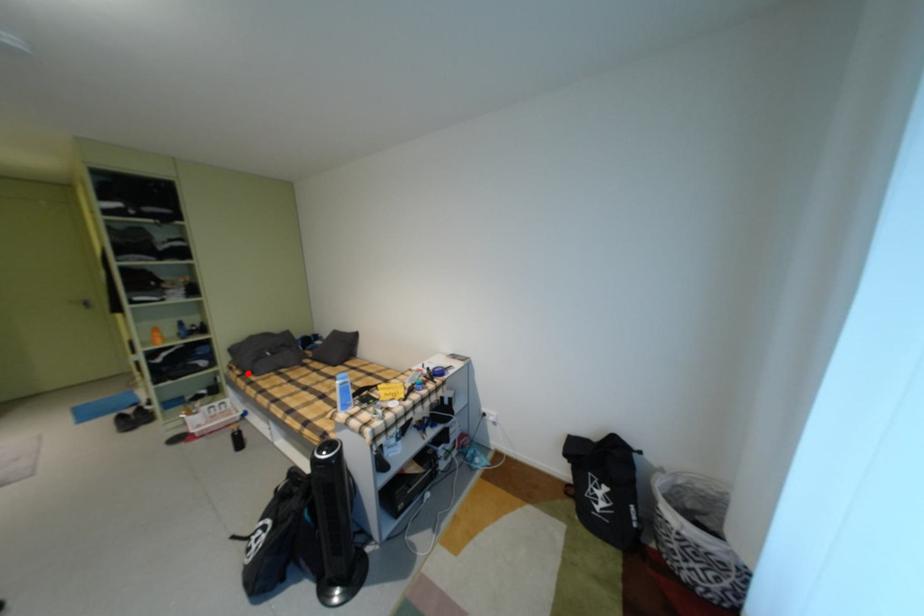
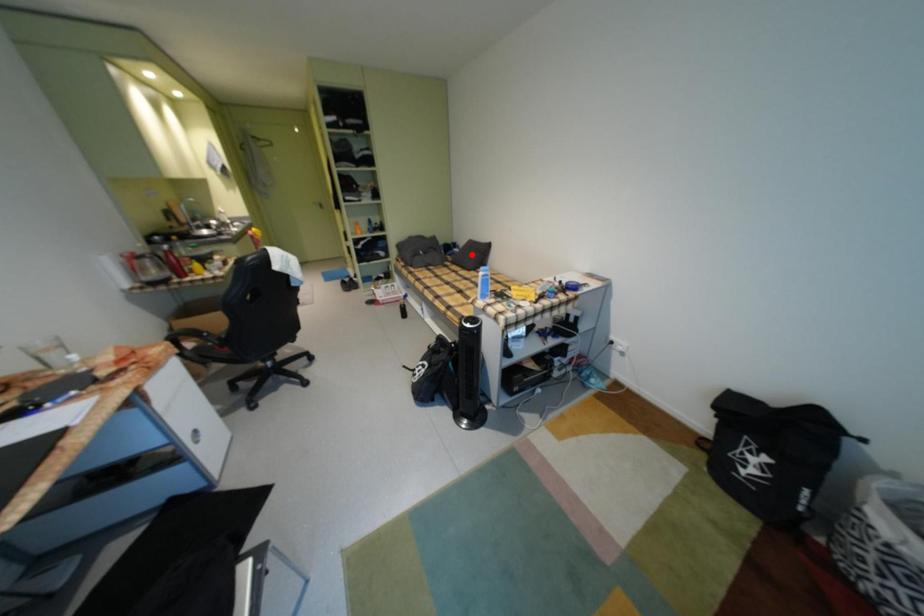
Consider the image. I am providing you with two images of the same scene from different viewpoints. A red point is marked on the first image and another point is marked on the second image. Is the red point in image1 aligned with the point shown in image2?

No